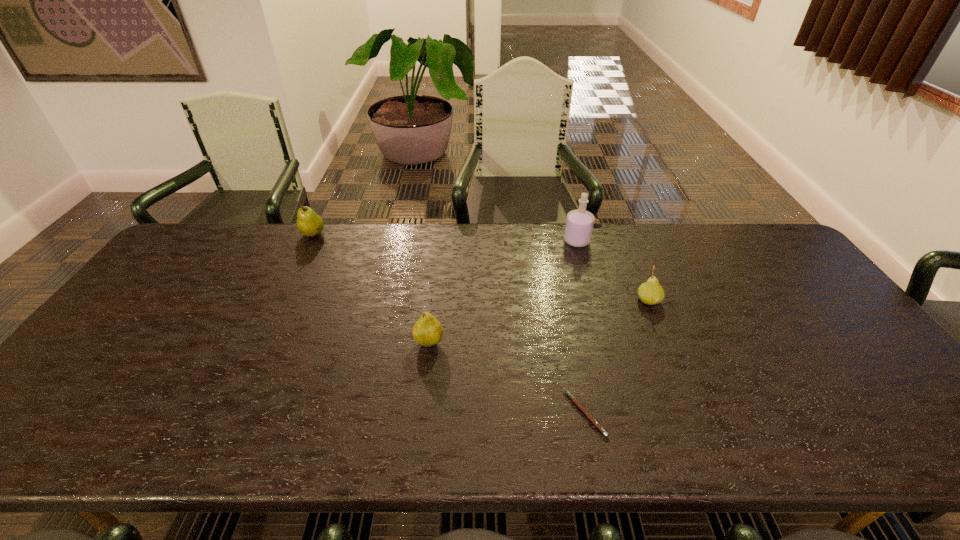
Where is `vacant space located 0.370m on the front of the tallest object`? The height and width of the screenshot is (540, 960). vacant space located 0.370m on the front of the tallest object is located at coordinates (602, 333).

Where is `vacant region located 0.090m on the front of the farthest pear`? This screenshot has width=960, height=540. vacant region located 0.090m on the front of the farthest pear is located at coordinates (301, 258).

This screenshot has width=960, height=540. What are the coordinates of `blank space located on the left of the rightmost object` in the screenshot? It's located at (549, 301).

The image size is (960, 540). Find the location of `vacant space located 0.320m on the back of the nearest pear`. vacant space located 0.320m on the back of the nearest pear is located at coordinates (439, 258).

You are a GUI agent. You are given a task and a screenshot of the screen. Output one action in this format:
    pyautogui.click(x=<x>, y=<y>)
    Task: Click on the vacant space located at the nib of the shortest object
    
    Given the screenshot: What is the action you would take?
    pyautogui.click(x=389, y=413)

Locate an element on the screen. The width and height of the screenshot is (960, 540). vacant space located at the nib of the shortest object is located at coordinates (509, 413).

Find the location of a particular element. The height and width of the screenshot is (540, 960). free space located 0.270m at the nib of the shortest object is located at coordinates (446, 413).

This screenshot has width=960, height=540. I want to click on perfume that is at the far edge, so click(579, 224).

Where is `pear present at the far edge`? The width and height of the screenshot is (960, 540). pear present at the far edge is located at coordinates [309, 223].

This screenshot has width=960, height=540. I want to click on object that is at the near edge, so click(573, 399).